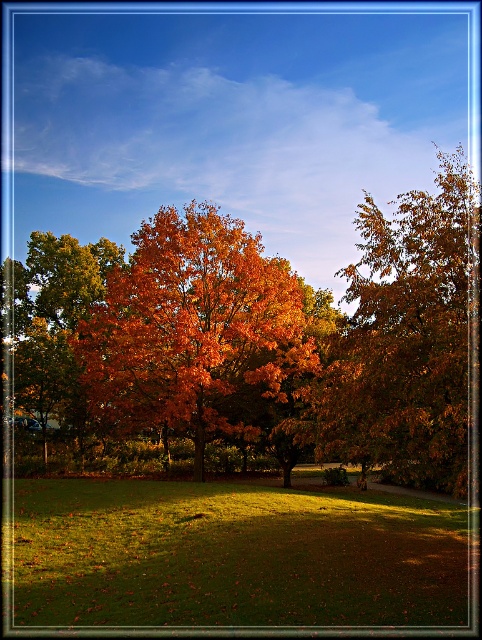
Question: Is the position of shiny orange leaves at center more distant than that of golden-brown leaves at right?

Choices:
 (A) yes
 (B) no

Answer: (A)

Question: Which of the following is the farthest from the observer?

Choices:
 (A) shiny orange leaves at center
 (B) orange leafy tree at center
 (C) golden-brown leaves at right

Answer: (B)

Question: Based on their relative distances, which object is farther from the orange leafy tree at center?

Choices:
 (A) golden-brown leaves at right
 (B) green grassy field at center

Answer: (A)

Question: Does golden-brown leaves at right have a greater width compared to orange leafy tree at center?

Choices:
 (A) no
 (B) yes

Answer: (B)

Question: Among these points, which one is nearest to the camera?

Choices:
 (A) (101, 588)
 (B) (395, 346)
 (C) (200, 269)
 (D) (23, 332)

Answer: (B)

Question: Can you confirm if shiny orange leaves at center is positioned below golden-brown leaves at right?

Choices:
 (A) yes
 (B) no

Answer: (A)